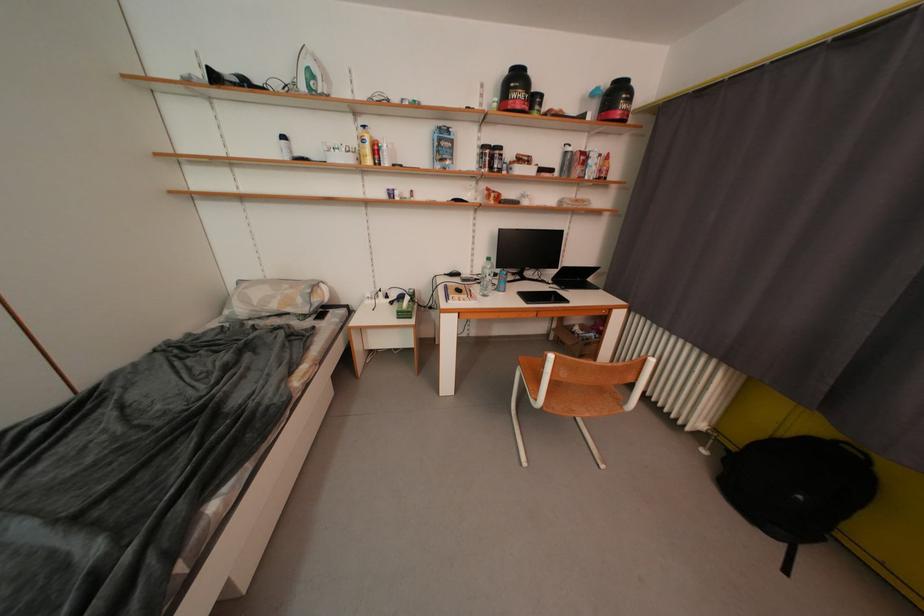
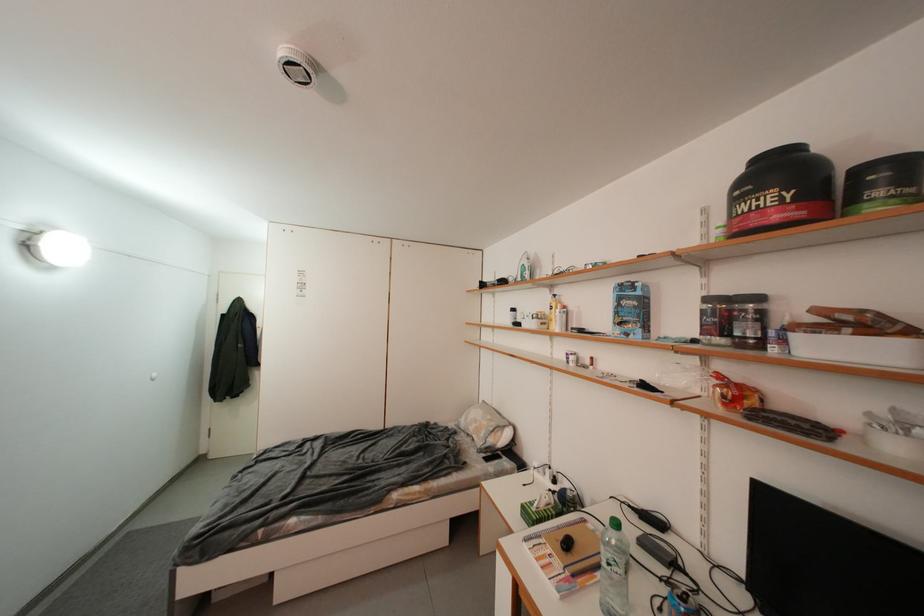
Locate, in the second image, the point that corresponds to [544,111] in the first image.

(886, 196)